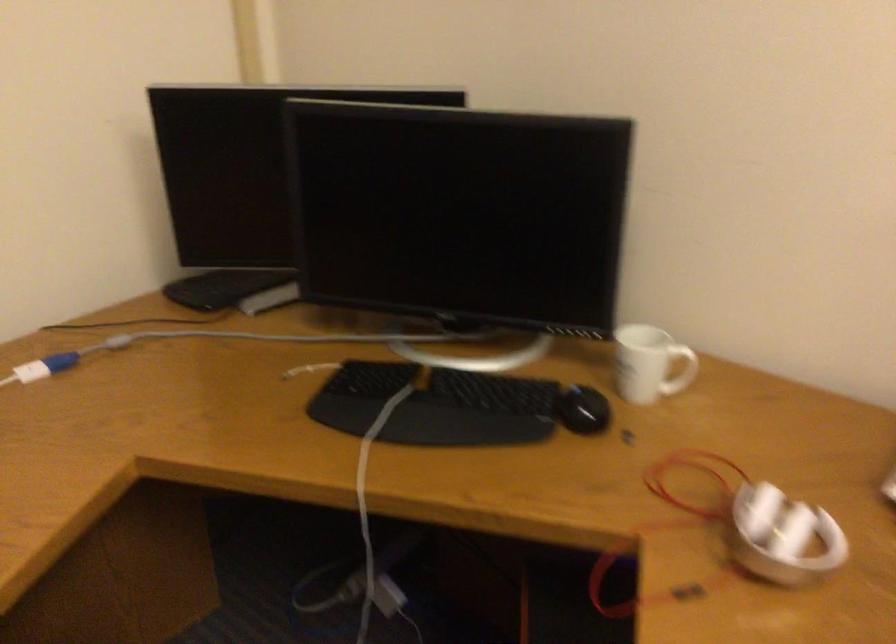
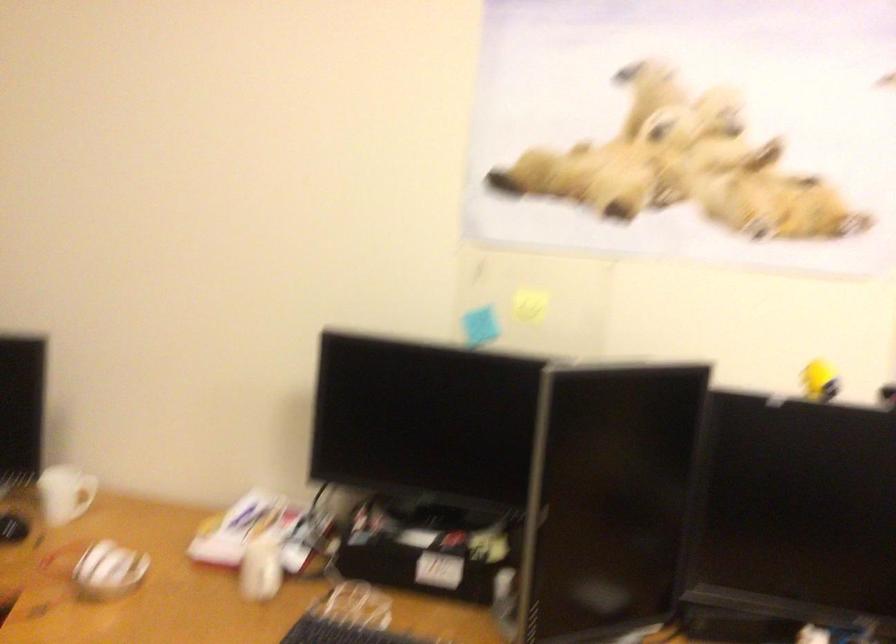
Locate, in the second image, the point that corresponds to (x=670, y=368) in the first image.

(83, 495)